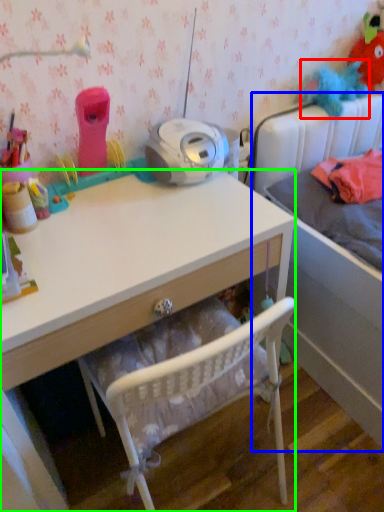
Question: Considering the real-world distances, which object is farthest from toy (highlighted by a red box)? bed (highlighted by a blue box) or desk (highlighted by a green box)?

Choices:
 (A) bed
 (B) desk

Answer: (B)